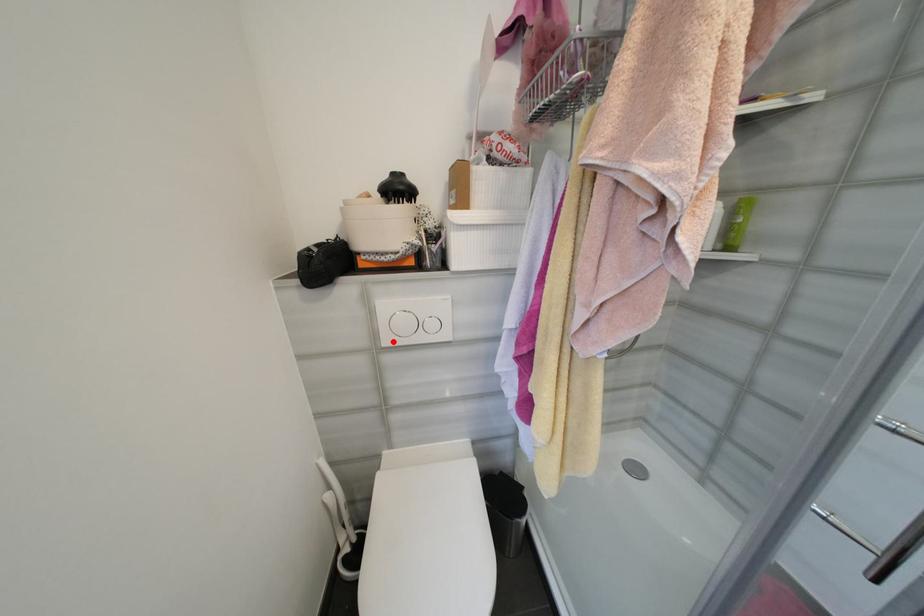
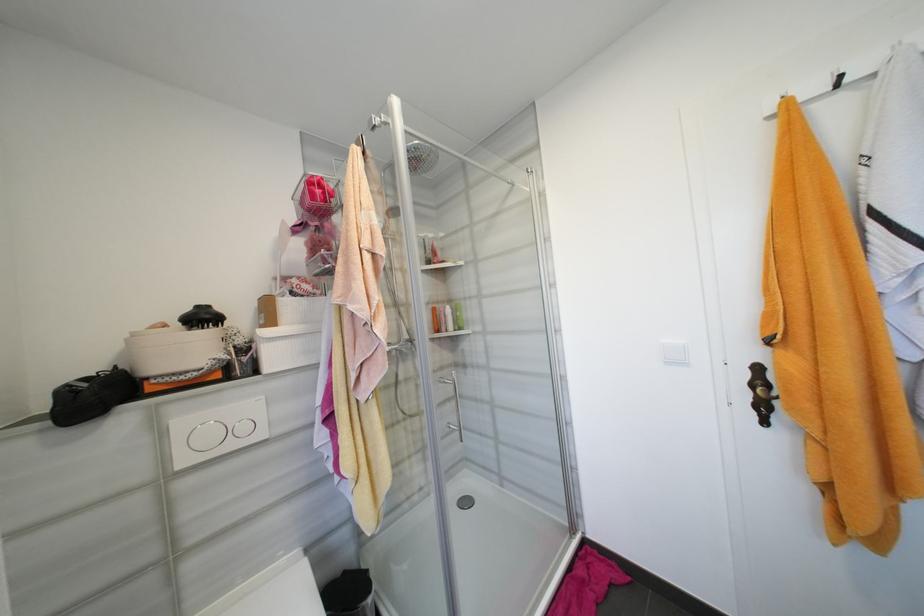
Where in the second image is the point corresponding to the highlighted location from the first image?

(189, 463)